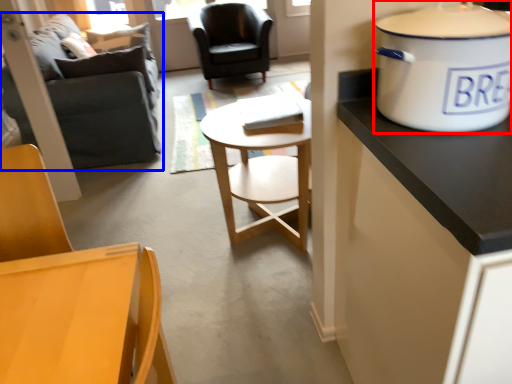
Question: Which point is closer to the camera, cooker (highlighted by a red box) or studio couch (highlighted by a blue box)?

Choices:
 (A) cooker
 (B) studio couch

Answer: (A)